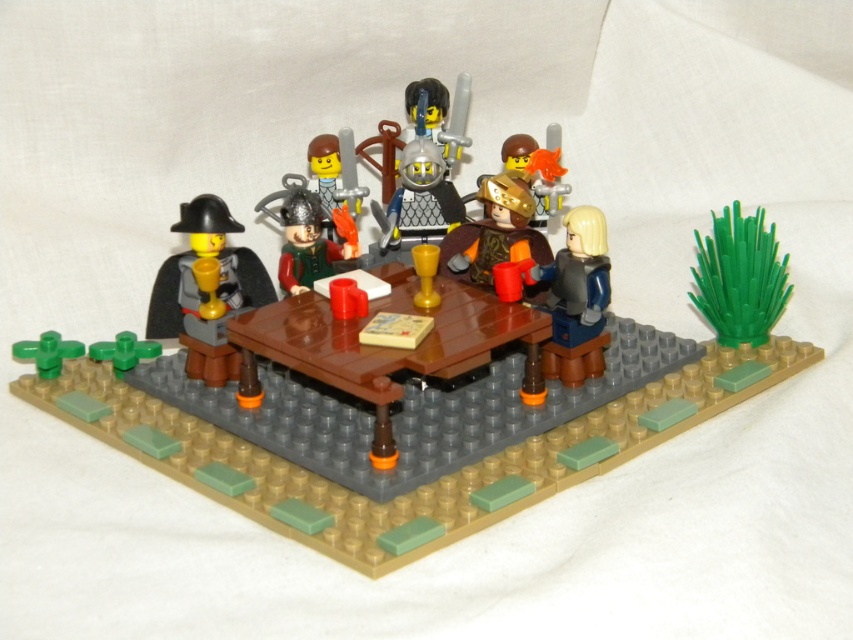
Who is higher up, matte black hat at left or silver metallic helmet at center?

silver metallic helmet at center

Which is below, matte black hat at left or silver metallic helmet at center?

matte black hat at left

Locate an element on the screen. matte black hat at left is located at coordinates (210, 288).

Who is positioned more to the left, silver metallic helmet at center or matte green armor at center?

matte green armor at center is more to the left.

Is silver metallic helmet at center closer to the viewer compared to matte green armor at center?

No, it is behind matte green armor at center.

Which is in front, point (370, 202) or point (286, 230)?

Point (286, 230)

Image resolution: width=853 pixels, height=640 pixels. Find the location of `silver metallic helmet at center`. silver metallic helmet at center is located at coordinates (424, 172).

How much distance is there between silver metallic helmet at center and gold metallic helmet at center?

silver metallic helmet at center and gold metallic helmet at center are 5.64 inches apart from each other.

I want to click on silver metallic helmet at center, so click(x=424, y=172).

Where is `silver metallic helmet at center`? silver metallic helmet at center is located at coordinates (424, 172).